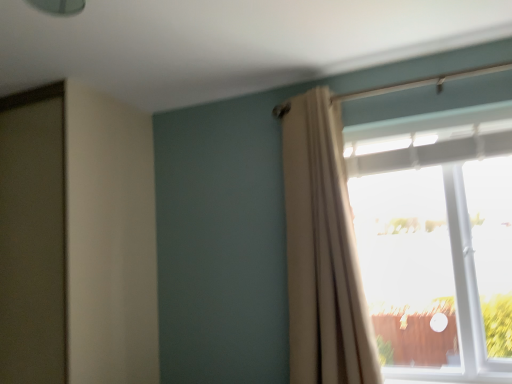
Question: From their relative heights in the image, would you say white sheer curtain at upper right is taller or shorter than transparent glass window at upper right?

Choices:
 (A) tall
 (B) short

Answer: (A)

Question: Looking at their shapes, would you say white sheer curtain at upper right is wider or thinner than transparent glass window at upper right?

Choices:
 (A) wide
 (B) thin

Answer: (B)

Question: Is point (304, 231) closer or farther from the camera than point (501, 190)?

Choices:
 (A) farther
 (B) closer

Answer: (B)

Question: Is point (416, 352) positioned closer to the camera than point (288, 109)?

Choices:
 (A) closer
 (B) farther

Answer: (A)

Question: In terms of height, does transparent glass window at upper right look taller or shorter compared to white sheer curtain at upper right?

Choices:
 (A) short
 (B) tall

Answer: (A)

Question: From a real-world perspective, is transparent glass window at upper right above or below white sheer curtain at upper right?

Choices:
 (A) above
 (B) below

Answer: (B)

Question: Visually, is transparent glass window at upper right positioned to the left or to the right of white sheer curtain at upper right?

Choices:
 (A) left
 (B) right

Answer: (B)